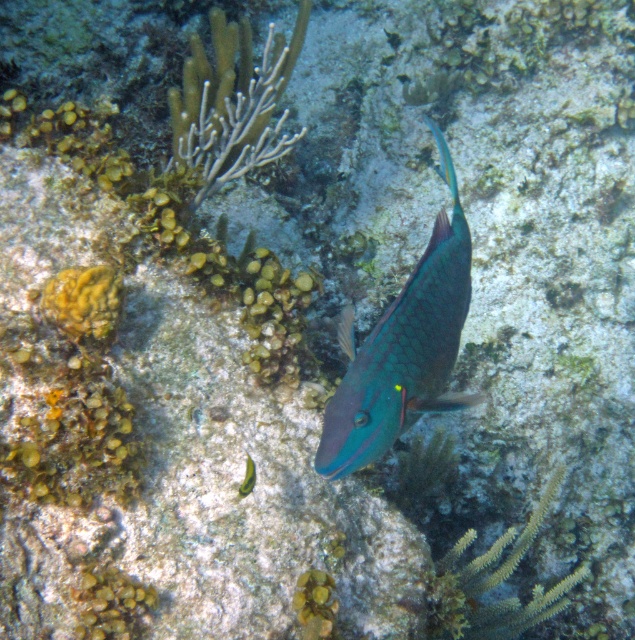
Is shiny teal fish at center behind green matte fish at center?

No, shiny teal fish at center is closer to the viewer.

Which is in front, point (462, 397) or point (255, 474)?

Point (462, 397) is in front.

Where is `shiny teal fish at center`? Image resolution: width=635 pixels, height=640 pixels. shiny teal fish at center is located at coordinates (403, 349).